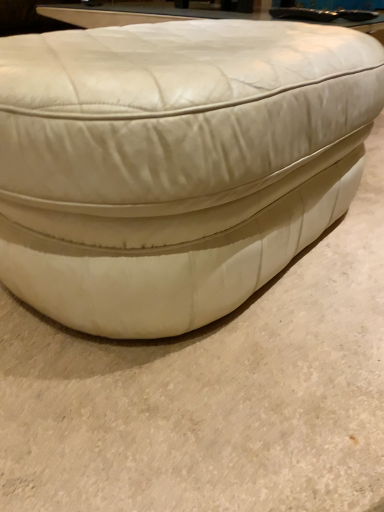
Measure the distance between white leather ottoman at center and camera.

white leather ottoman at center and camera are 48.92 centimeters apart from each other.

Find the location of a particular element. white leather ottoman at center is located at coordinates (174, 164).

Image resolution: width=384 pixels, height=512 pixels. Describe the element at coordinates (174, 164) in the screenshot. I see `white leather ottoman at center` at that location.

Locate an element on the screen. This screenshot has width=384, height=512. white leather ottoman at center is located at coordinates (174, 164).